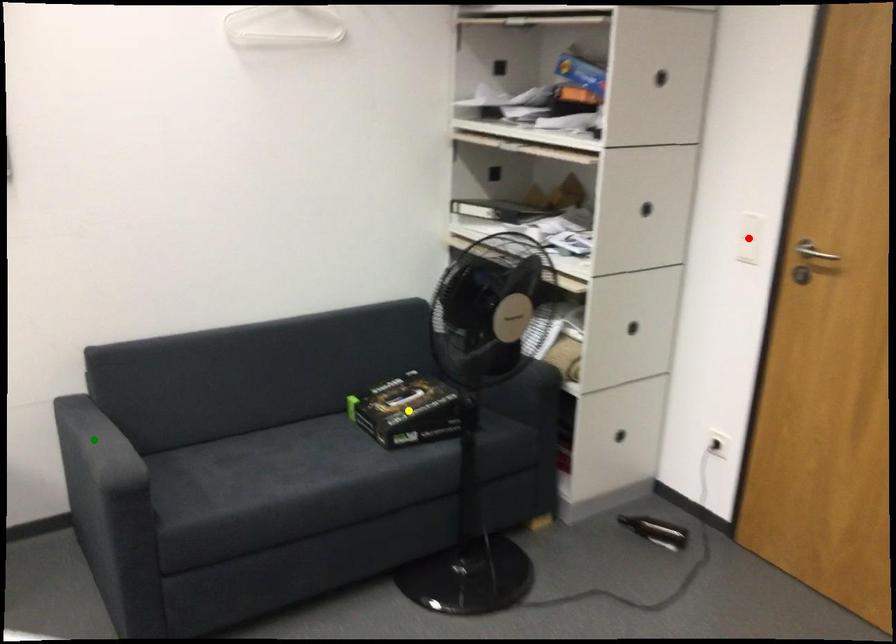
Order these from nearest to farthest:
yellow point
green point
red point

green point < red point < yellow point